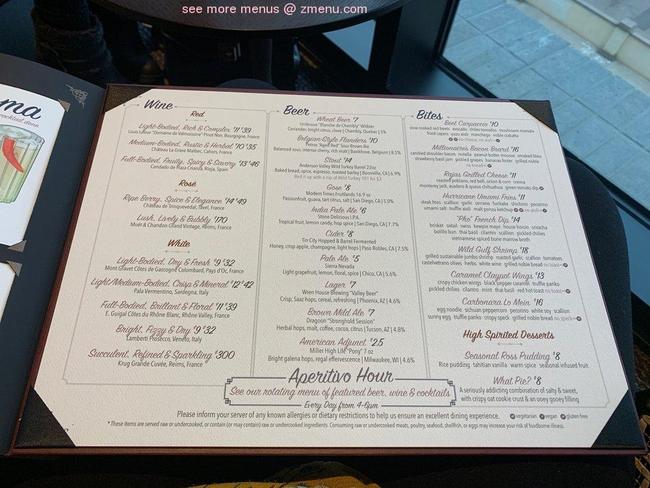
The width and height of the screenshot is (650, 488). In order to click on window in this screenshot , I will do `click(625, 118)`.